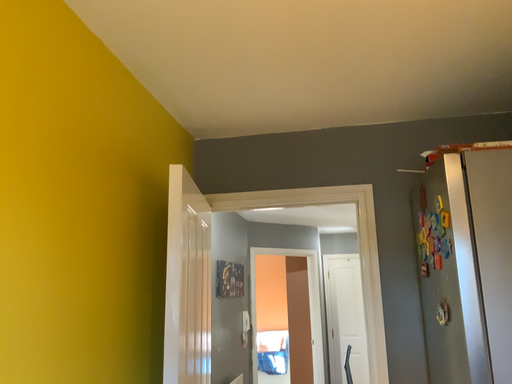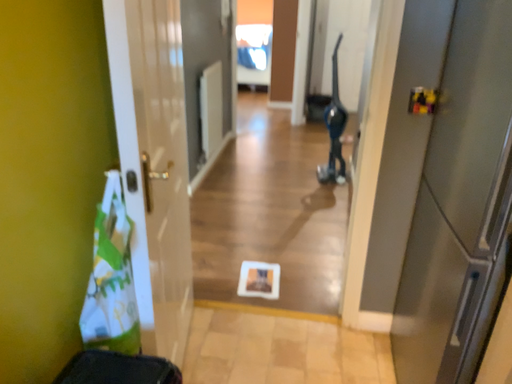
Question: Which way did the camera rotate in the video?

Choices:
 (A) rotated downward
 (B) rotated upward

Answer: (A)